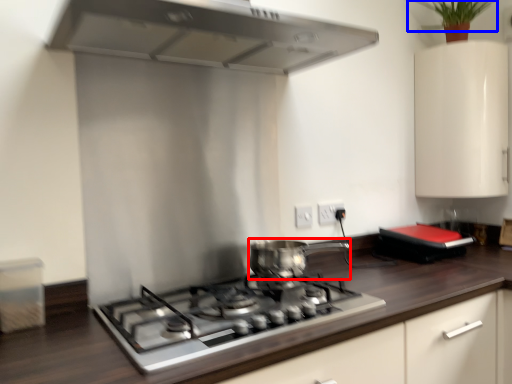
Question: Which object appears farthest to the camera in this image, kitchen appliance (highlighted by a red box) or plant (highlighted by a blue box)?

Choices:
 (A) kitchen appliance
 (B) plant

Answer: (B)